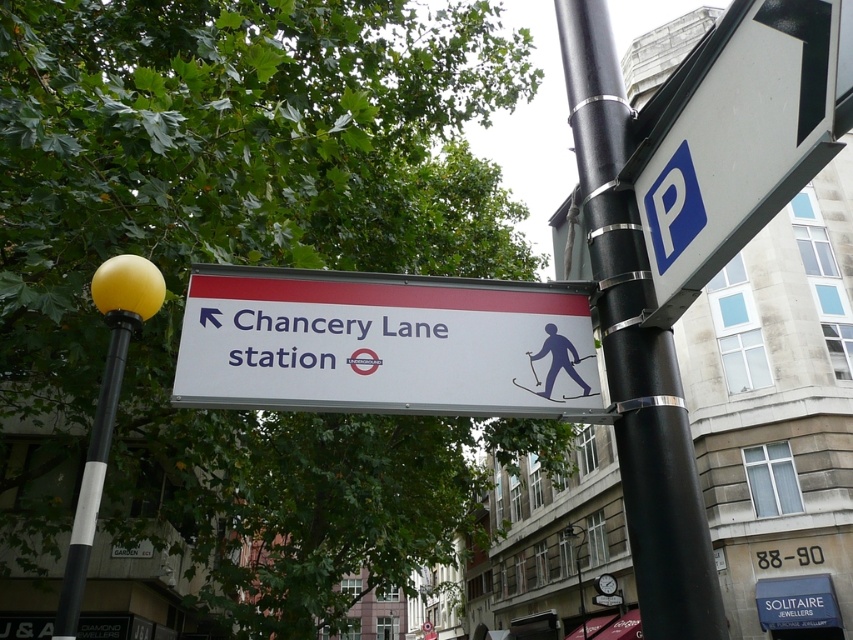
Can you confirm if white plastic sign at center is positioned below blue plastic parking sign at upper right?

Yes, white plastic sign at center is below blue plastic parking sign at upper right.

Between white plastic sign at center and blue plastic parking sign at upper right, which one has more height?

Standing taller between the two is blue plastic parking sign at upper right.

Identify the location of white plastic sign at center. The image size is (853, 640). (386, 344).

Is blue plastic parking sign at upper right in front of black metallic pole at upper right?

Yes, it is.

Which is in front, point (735, 84) or point (648, 515)?

Positioned in front is point (735, 84).

You are a GUI agent. You are given a task and a screenshot of the screen. Output one action in this format:
    pyautogui.click(x=<x>, y=<y>)
    Task: Click on the blue plastic parking sign at upper right
    
    Given the screenshot: What is the action you would take?
    pyautogui.click(x=735, y=136)

Who is shorter, blue plastic parking sign at upper right or matte blue skier at center?

Standing shorter between the two is matte blue skier at center.

Where is `blue plastic parking sign at upper right`? The height and width of the screenshot is (640, 853). blue plastic parking sign at upper right is located at coordinates (735, 136).